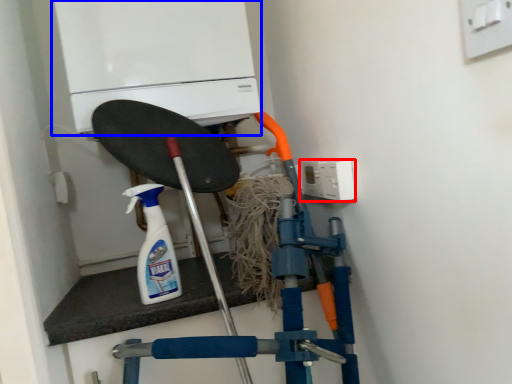
Question: Among these objects, which one is farthest to the camera, electric outlet (highlighted by a red box) or home appliance (highlighted by a blue box)?

Choices:
 (A) electric outlet
 (B) home appliance

Answer: (B)